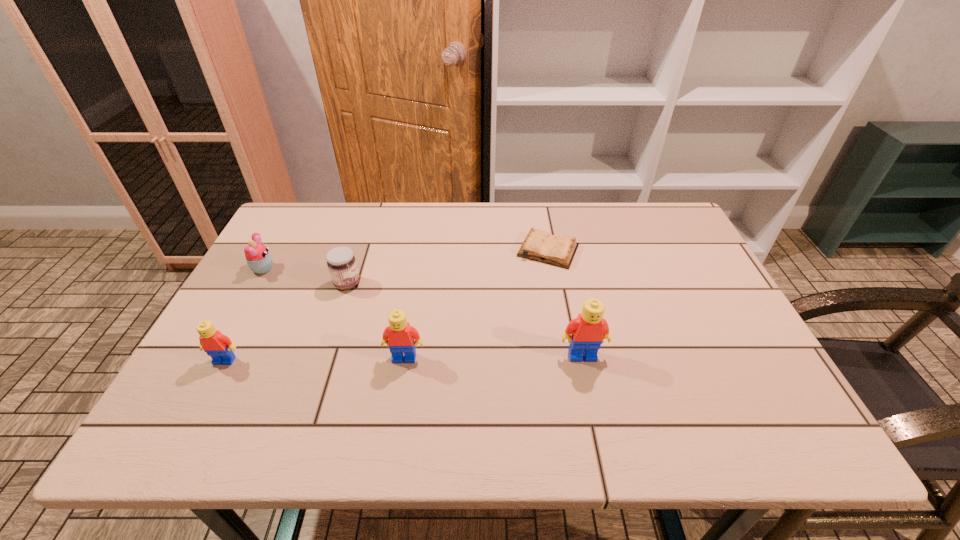
Find the location of a particular element. Image resolution: width=960 pixels, height=540 pixels. the shortest Lego is located at coordinates (217, 345).

In order to click on the leftmost Lego in this screenshot , I will do `click(217, 345)`.

Locate an element on the screen. The height and width of the screenshot is (540, 960). the second tallest object is located at coordinates (399, 336).

Locate an element on the screen. The height and width of the screenshot is (540, 960). the third object from right to left is located at coordinates (399, 336).

Find the location of a particular element. the rightmost Lego is located at coordinates (586, 333).

Where is `diary`? The height and width of the screenshot is (540, 960). diary is located at coordinates (559, 250).

Image resolution: width=960 pixels, height=540 pixels. What are the coordinates of `the third object from left to right` in the screenshot? It's located at (341, 262).

Image resolution: width=960 pixels, height=540 pixels. Find the location of `cupcake`. cupcake is located at coordinates (259, 260).

Where is `free spot located on the face of the leftmost Lego`? Image resolution: width=960 pixels, height=540 pixels. free spot located on the face of the leftmost Lego is located at coordinates (204, 401).

Identify the location of free space located 0.090m on the face of the second tallest object. (397, 399).